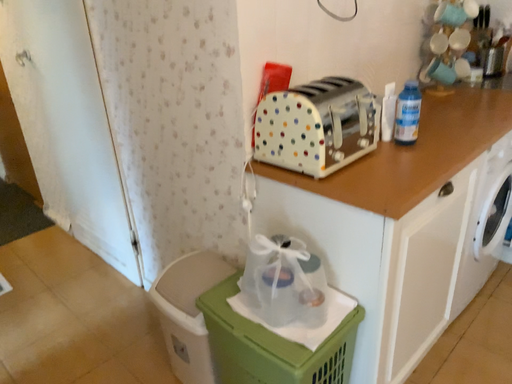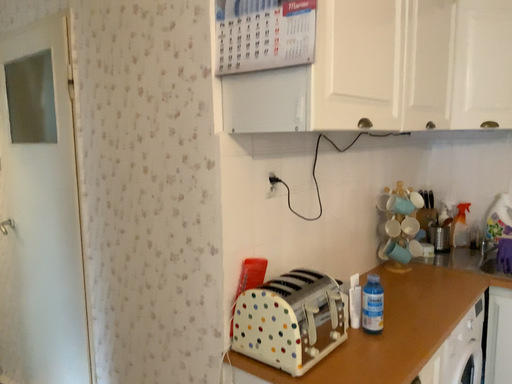
Question: How did the camera likely rotate when shooting the video?

Choices:
 (A) rotated upward
 (B) rotated downward

Answer: (A)